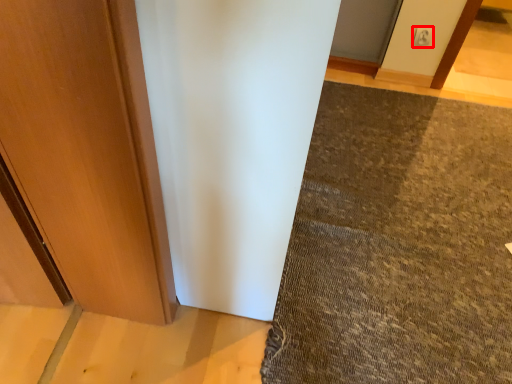
Question: From the image's perspective, where is electric outlet (annotated by the red box) located in relation to mat in the image?

Choices:
 (A) below
 (B) above

Answer: (B)